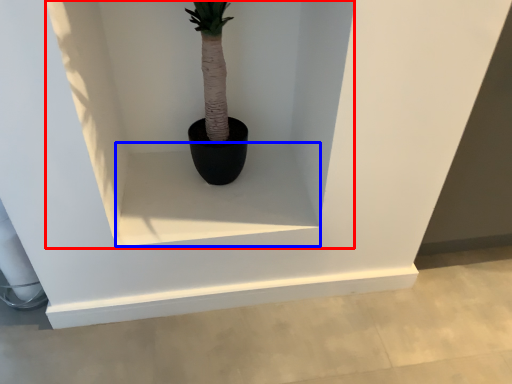
Question: Which of the following is the farthest to the observer, shelf (highlighted by a red box) or window sill (highlighted by a blue box)?

Choices:
 (A) shelf
 (B) window sill

Answer: (B)